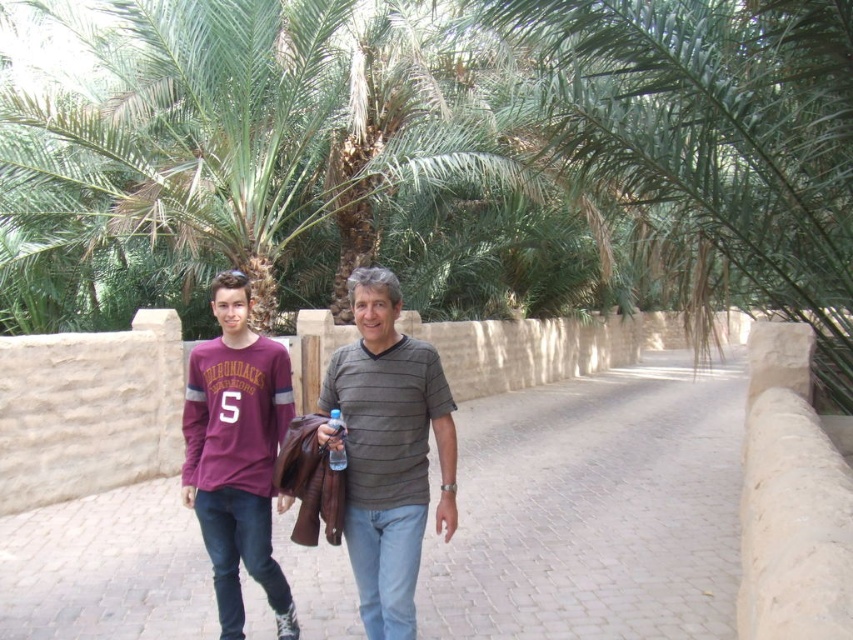
You are a photographer standing on the pathway. You want to take a photo of the gray striped shirt at center and the transparent plastic bottle at center. Which object should you focus on first if you want the closer one to be in focus?

The gray striped shirt at center has a larger size compared to the transparent plastic bottle at center, so you should focus on the gray striped shirt at center first since it is closer to you.

You are standing at the edge of the pathway and want to hand a leaflet to the person wearing the gray striped shirt at center. If you can throw the leaflet up to 3 meters, will you be able to reach them?

The gray striped shirt at center and viewer are 2.58 meters apart. Since the viewer can throw up to 3 meters, they can successfully reach the gray striped shirt at center with the leaflet.